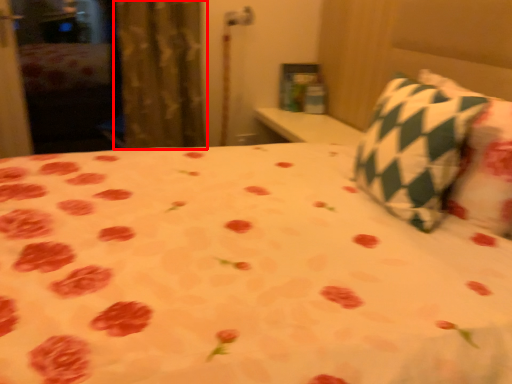
Question: Where is curtain (annotated by the red box) located in relation to pillow in the image?

Choices:
 (A) left
 (B) right

Answer: (A)